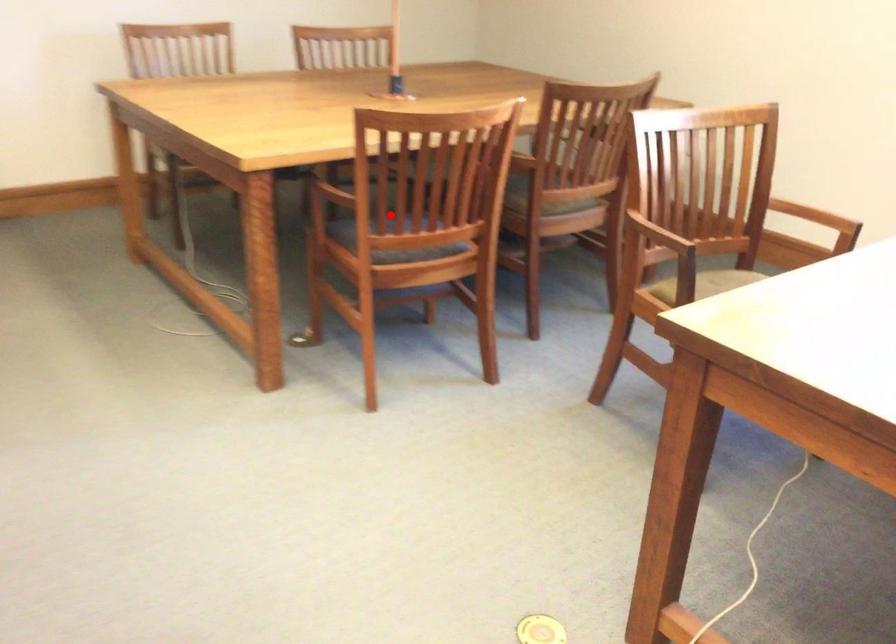
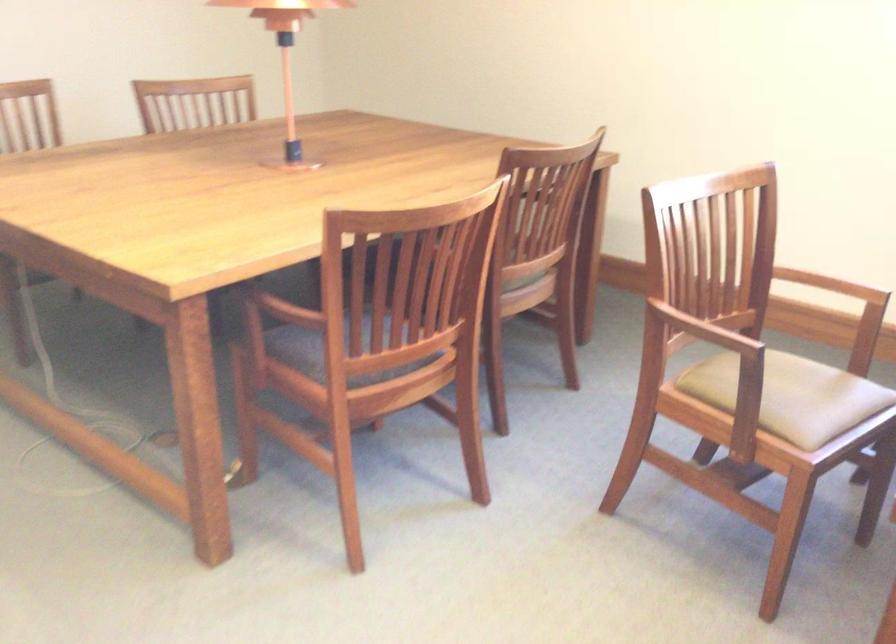
Locate, in the second image, the point that corresponds to the highlighted location in the first image.

(366, 330)